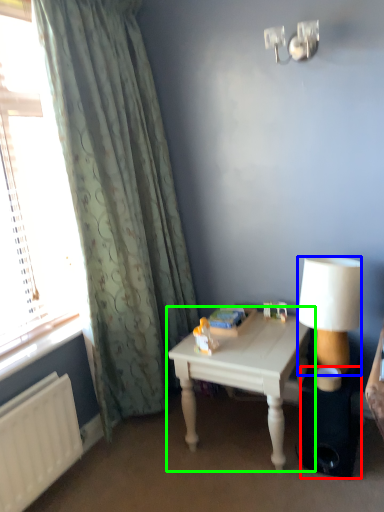
Question: Which object is the closest to the loudspeaker (highlighted by a red box)? Choose among these: lamp (highlighted by a blue box) or table (highlighted by a green box).

Choices:
 (A) lamp
 (B) table

Answer: (A)